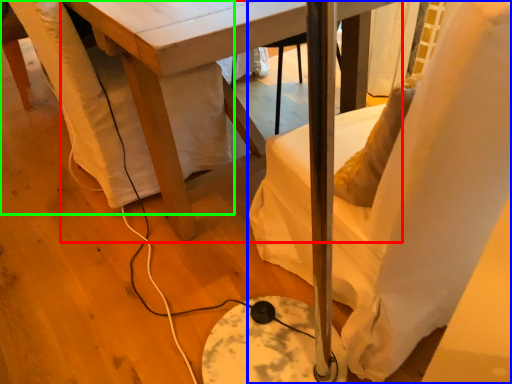
Question: Based on their relative distances, which object is nearer to table (highlighted by a red box)? Choose from chair (highlighted by a blue box) and swivel chair (highlighted by a green box).

Choices:
 (A) chair
 (B) swivel chair

Answer: (B)